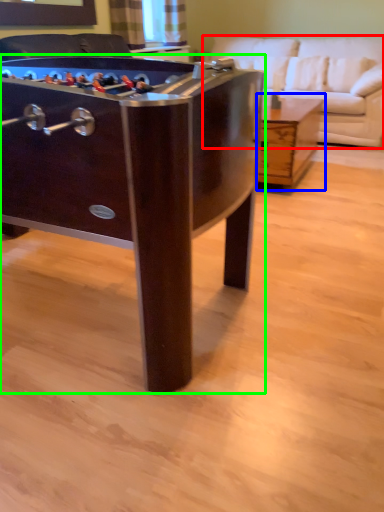
Question: Based on their relative distances, which object is farther from studio couch (highlighted by a red box)? Choose from table (highlighted by a blue box) and table (highlighted by a green box).

Choices:
 (A) table
 (B) table

Answer: (B)